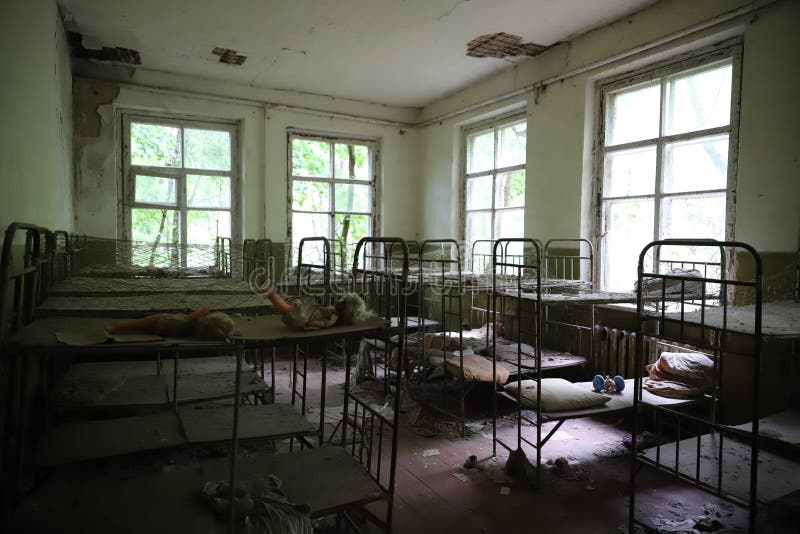
Image resolution: width=800 pixels, height=534 pixels. Identify the location of ceiling. (346, 43).